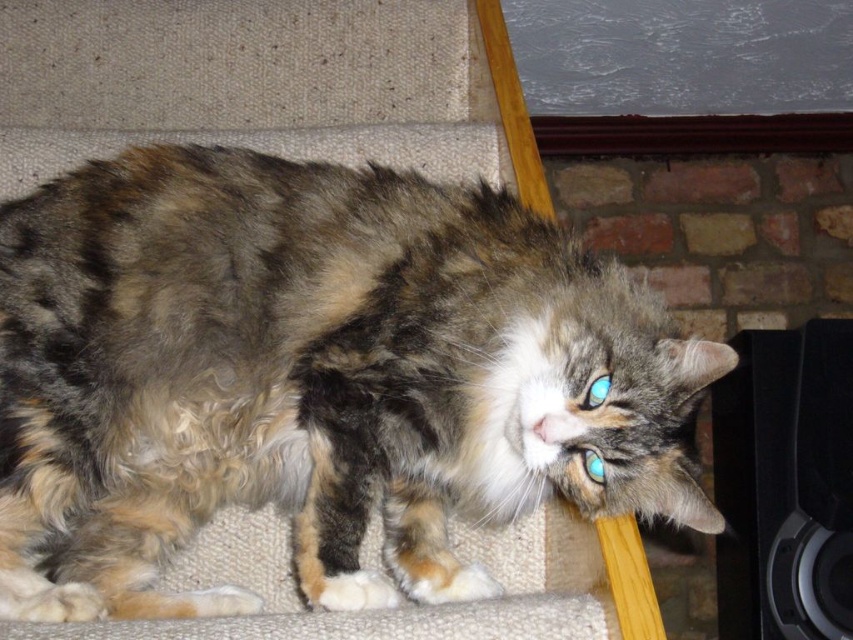
Is fuzzy fur cat at center positioned behind black matte speaker at right?

That is False.

How far apart are fuzzy fur cat at center and black matte speaker at right?

fuzzy fur cat at center is 3.69 feet from black matte speaker at right.

Identify the location of fuzzy fur cat at center. (312, 378).